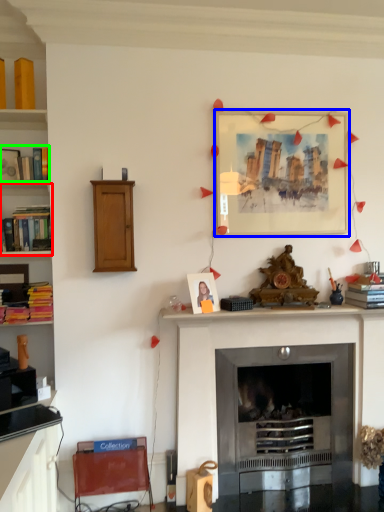
Question: Based on their relative distances, which object is nearer to shelf (highlighted by a red box)? Choose from picture frame (highlighted by a blue box) and book (highlighted by a green box).

Choices:
 (A) picture frame
 (B) book

Answer: (B)